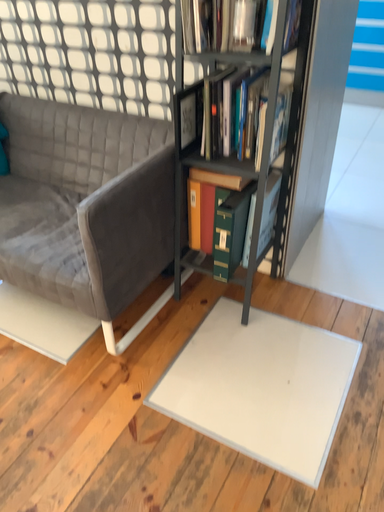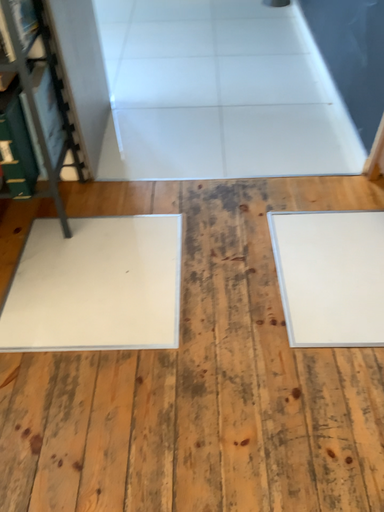
Question: Which way did the camera rotate in the video?

Choices:
 (A) rotated upward
 (B) rotated downward

Answer: (B)